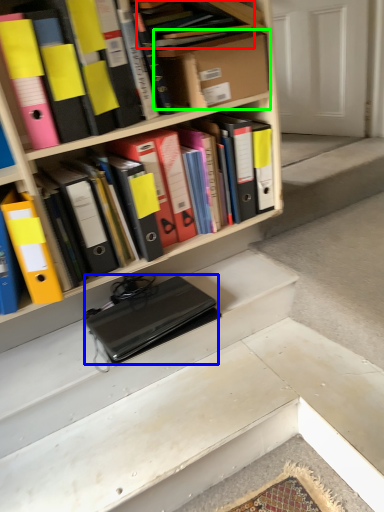
Question: Which object is the farthest from book (highlighted by a red box)? Choose among these: laptop (highlighted by a blue box) or cardboard box (highlighted by a green box).

Choices:
 (A) laptop
 (B) cardboard box

Answer: (A)